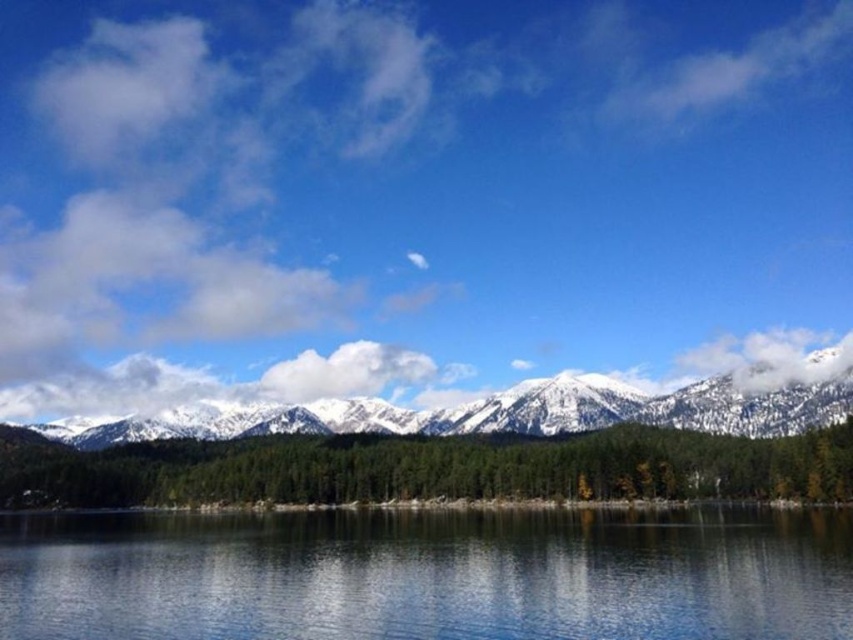
You are an artist trying to paint the landscape. You want to place the transparent glass water at center in your painting. Where should you position it on your canvas? Please provide coordinates in the format of a point like this example format, e.g., point at point 0.898, 0.504. Do not add any other information.

The transparent glass water at center should be positioned at point (428, 573) on the canvas.

You are a photographer standing at the edge of the lake and want to capture the snowy white mountain range at center in your shot. However, the transparent glass water at center is blocking your view. Can you move to the left or right to avoid the water and still see the mountain range?

The transparent glass water at center is positioned on the right side of snowy white mountain range at center. Therefore, moving to the left of the transparent glass water at center would allow you to avoid the water and still see the snowy white mountain range at center.

You are standing at the edge of the water in the serene landscape. There is a specific point marked at coordinates point (323,545). Can you estimate how far this point is from your current position?

The point (323,545) is 139.40 meters away from the viewer, so the distance is approximately 139.40 meters.